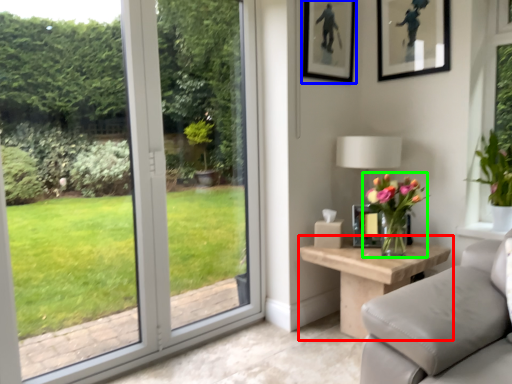
Question: Estimate the real-world distances between objects in this image. Which object is farther from table (highlighted by a red box), picture frame (highlighted by a blue box) or houseplant (highlighted by a green box)?

Choices:
 (A) picture frame
 (B) houseplant

Answer: (A)